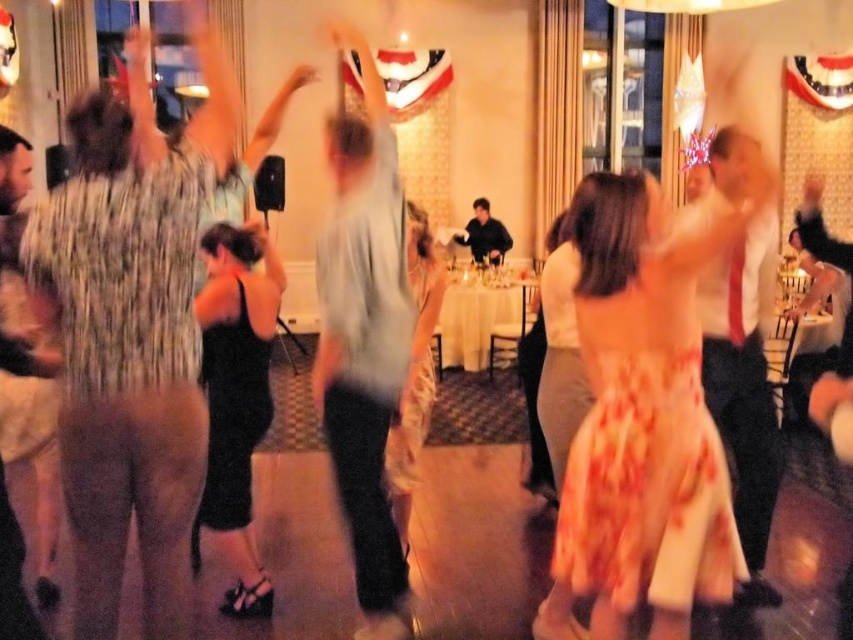
Is light gray cotton shirt at center wider than floral-patterned fabric dress at center?

No, light gray cotton shirt at center is not wider than floral-patterned fabric dress at center.

Can you confirm if light gray cotton shirt at center is taller than floral-patterned fabric dress at center?

Indeed, light gray cotton shirt at center has a greater height compared to floral-patterned fabric dress at center.

Between point (399, 353) and point (692, 470), which one is positioned in front?

Positioned in front is point (692, 470).

I want to click on light gray cotton shirt at center, so click(x=364, y=339).

Who is shorter, black satin dress at center or dark blue shirt at center?

Standing shorter between the two is dark blue shirt at center.

Which is in front, point (241, 404) or point (486, 236)?

Point (241, 404)

Where is `black satin dress at center`? The height and width of the screenshot is (640, 853). black satin dress at center is located at coordinates (233, 416).

Does matte white shirt at center have a greater width compared to dark blue shirt at center?

No.

Can you confirm if matte white shirt at center is positioned to the left of dark blue shirt at center?

Incorrect, matte white shirt at center is not on the left side of dark blue shirt at center.

Is point (770, 474) more distant than point (508, 243)?

No, (770, 474) is in front of (508, 243).

Find the location of a particular element. Image resolution: width=853 pixels, height=640 pixels. matte white shirt at center is located at coordinates (743, 388).